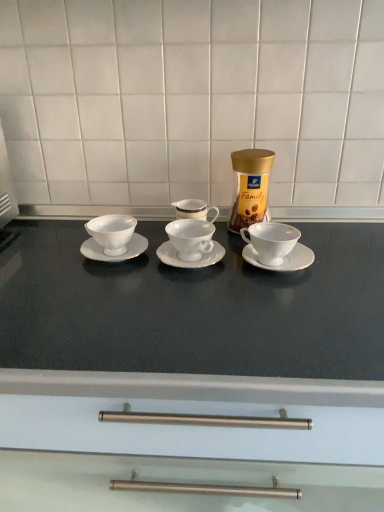
This screenshot has width=384, height=512. In order to click on vacant space in front of gold metallic jar at center in this screenshot , I will do `click(264, 267)`.